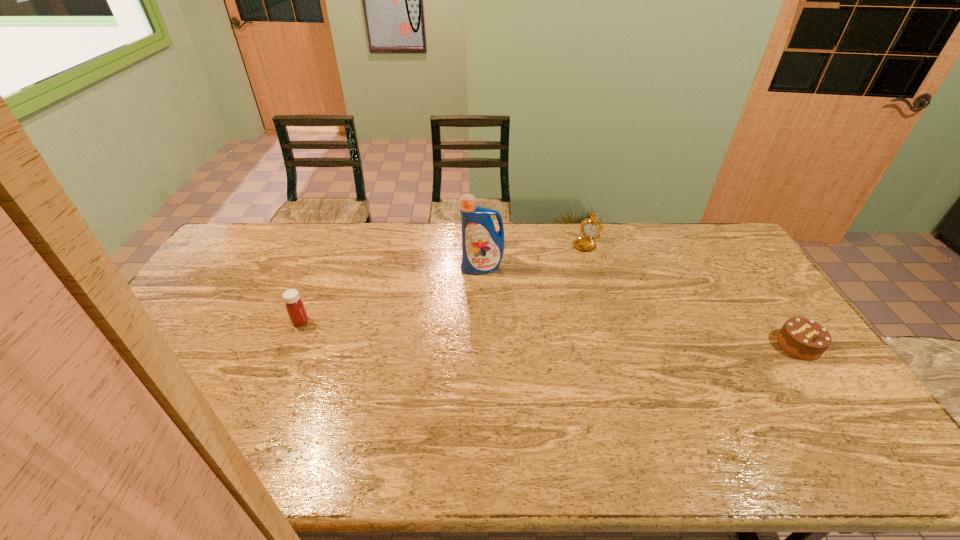
The width and height of the screenshot is (960, 540). What are the coordinates of `vacant space that is in between the tallest object and the farthest object` in the screenshot? It's located at (538, 256).

What are the coordinates of `vacant space that is in between the farthest object and the medicine` in the screenshot? It's located at (447, 284).

Locate an element on the screen. This screenshot has height=540, width=960. free space that is in between the third farthest object and the nearest object is located at coordinates (550, 333).

Where is `object that is the closest to the second farthest object`? This screenshot has width=960, height=540. object that is the closest to the second farthest object is located at coordinates (590, 228).

Where is `object that stands as the third closest to the shortest object`? object that stands as the third closest to the shortest object is located at coordinates (294, 305).

Where is `vacant space that satisfies the following two spatial constraints: 1. on the back side of the leftmost object; 2. on the left side of the pocket watch`? Image resolution: width=960 pixels, height=540 pixels. vacant space that satisfies the following two spatial constraints: 1. on the back side of the leftmost object; 2. on the left side of the pocket watch is located at coordinates (332, 246).

Locate an element on the screen. The height and width of the screenshot is (540, 960). free space that satisfies the following two spatial constraints: 1. on the back side of the medicine; 2. on the right side of the third object from right to left is located at coordinates [x=323, y=268].

Locate an element on the screen. Image resolution: width=960 pixels, height=540 pixels. free location that satisfies the following two spatial constraints: 1. on the front side of the nearest object; 2. on the left side of the farthest object is located at coordinates (625, 345).

Locate an element on the screen. The width and height of the screenshot is (960, 540). vacant region that satisfies the following two spatial constraints: 1. on the back side of the leftmost object; 2. on the right side of the farthest object is located at coordinates (332, 246).